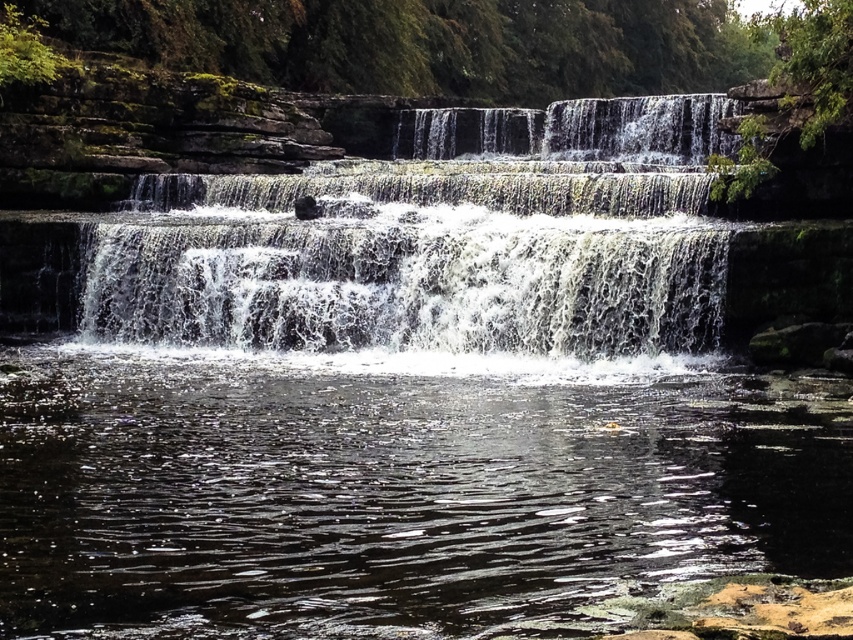
You are an explorer trying to cross the waterfall area. You need to step on the white frothy water at center and the white frothy water at upper center. Which one should you step on first to reach the other side safely?

You should step on the white frothy water at upper center first because it is lower in height compared to the white frothy water at center, making it easier to navigate safely.

You are standing at the base of the waterfall and want to reach the point marked by the coordinates. Which point, point [415,554] or point [727,141], is closer to you?

Point [415,554] is closer to you because it is in front of point [727,141].